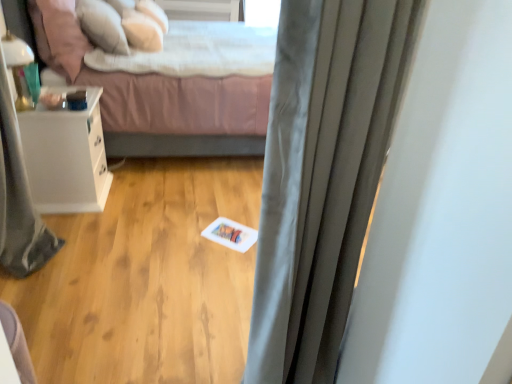
Image resolution: width=512 pixels, height=384 pixels. Identify the location of vacant area on the back side of white matte card at center. (232, 213).